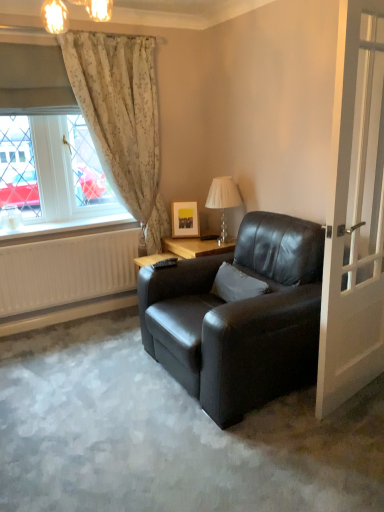
Question: Would you say white glossy door at right is outside matte black armchair at center?

Choices:
 (A) yes
 (B) no

Answer: (A)

Question: Is white glossy door at right bigger than matte black armchair at center?

Choices:
 (A) yes
 (B) no

Answer: (B)

Question: From the image's perspective, is white glossy door at right under matte black armchair at center?

Choices:
 (A) yes
 (B) no

Answer: (B)

Question: Would you say white glossy door at right contains matte black armchair at center?

Choices:
 (A) yes
 (B) no

Answer: (B)

Question: From a real-world perspective, is white glossy door at right over matte black armchair at center?

Choices:
 (A) no
 (B) yes

Answer: (B)

Question: Do you think white glossy door at right is within matte wooden picture frame at upper right, or outside of it?

Choices:
 (A) inside
 (B) outside

Answer: (B)

Question: Considering the positions of white glossy door at right and matte wooden picture frame at upper right in the image, is white glossy door at right taller or shorter than matte wooden picture frame at upper right?

Choices:
 (A) short
 (B) tall

Answer: (B)

Question: Is white glossy door at right wider or thinner than matte wooden picture frame at upper right?

Choices:
 (A) thin
 (B) wide

Answer: (A)

Question: From the image's perspective, is white glossy door at right above or below matte wooden picture frame at upper right?

Choices:
 (A) above
 (B) below

Answer: (B)

Question: Looking at the image, does translucent glass table lamp at upper center seem bigger or smaller compared to white floral curtains at upper left?

Choices:
 (A) small
 (B) big

Answer: (A)

Question: Is translucent glass table lamp at upper center to the left or to the right of white floral curtains at upper left in the image?

Choices:
 (A) left
 (B) right

Answer: (B)

Question: In terms of width, does translucent glass table lamp at upper center look wider or thinner when compared to white floral curtains at upper left?

Choices:
 (A) thin
 (B) wide

Answer: (B)

Question: Is translucent glass table lamp at upper center inside or outside of white floral curtains at upper left?

Choices:
 (A) inside
 (B) outside

Answer: (B)

Question: From the image's perspective, relative to floral fabric curtain at left, is white soft pillow at center above or below?

Choices:
 (A) below
 (B) above

Answer: (A)

Question: Is point (218, 295) closer or farther from the camera than point (163, 221)?

Choices:
 (A) closer
 (B) farther

Answer: (A)